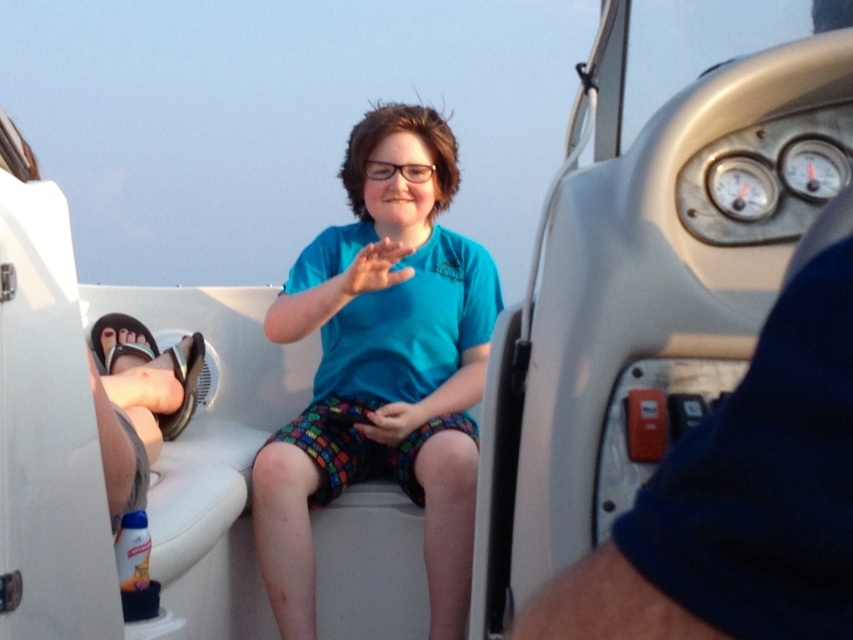
Does matte blue shirt at center come in front of multicolored fabric hand at center?

That is True.

Is matte blue shirt at center smaller than multicolored fabric hand at center?

Actually, matte blue shirt at center might be larger than multicolored fabric hand at center.

Is point (334, 280) less distant than point (375, 410)?

Yes, it is in front of point (375, 410).

Where is `matte blue shirt at center`? The image size is (853, 640). matte blue shirt at center is located at coordinates (372, 269).

Who is more distant from viewer, [368,452] or [575,572]?

The point [368,452] is more distant.

Is teal fabric shirt at center taller than blue fabric shirt at center?

Yes, teal fabric shirt at center is taller than blue fabric shirt at center.

Is point (447, 234) positioned behind point (820, 339)?

That is True.

The width and height of the screenshot is (853, 640). What are the coordinates of `teal fabric shirt at center` in the screenshot? It's located at (383, 369).

Between teal fabric shirt at center and matte blue shirt at center, which one appears on the left side from the viewer's perspective?

Positioned to the left is matte blue shirt at center.

Locate an element on the screen. teal fabric shirt at center is located at coordinates (383, 369).